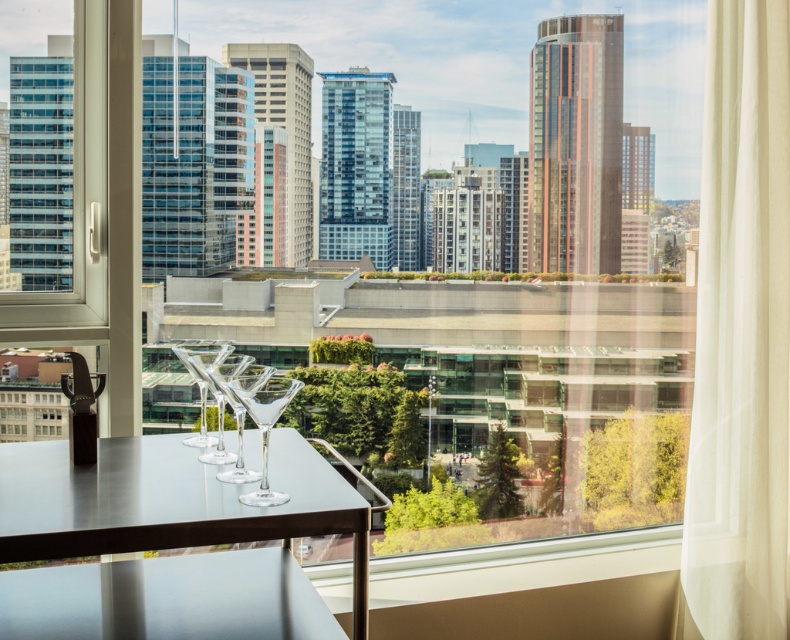
Question: Which is farther from the transparent glass window at left?

Choices:
 (A) clear glass wine glass at center
 (B) satin silver table at lower left
 (C) transparent glass martini glass at center

Answer: (A)

Question: Does satin silver table at lower left appear on the left side of transparent glass martini glass at center?

Choices:
 (A) yes
 (B) no

Answer: (A)

Question: Which object appears closest to the camera in this image?

Choices:
 (A) transparent glass window at left
 (B) satin silver table at lower left

Answer: (B)

Question: Does white sheer curtain at right appear under clear glass wine glass at center?

Choices:
 (A) no
 (B) yes

Answer: (A)

Question: Does transparent glass window at left appear under transparent glass martini glass at center?

Choices:
 (A) no
 (B) yes

Answer: (A)

Question: Considering the real-world distances, which object is closest to the white sheer curtain at right?

Choices:
 (A) transparent glass window at left
 (B) clear glass wine glass at center
 (C) satin silver table at lower left
 (D) transparent glass martini glass at center

Answer: (B)